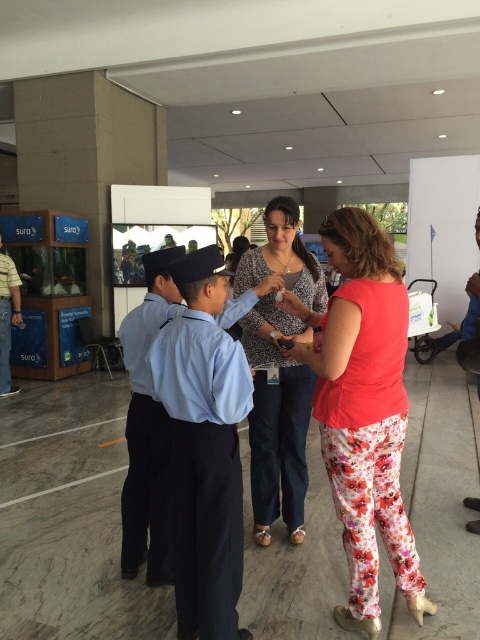
You are a photographer standing at the entrance of the building. You want to take a photo of the two objects labeled floral cotton pants at center and floral pants at center. Since they are both at the center, how far apart are they from each other?

The floral cotton pants at center is 54.94 centimeters away from floral pants at center.

You are a tailor observing two outfits at the center of the scene. The light blue uniform at center and the floral pants at center. Which outfit has a wider width?

The light blue uniform at center has a greater width compared to the floral pants at center as stated in the description.

You are a tailor observing two pairs of pants in the image. The first is labeled as floral cotton pants at center, and the second is floral pants at center. Which pair has a wider leg opening?

The floral cotton pants at center has a wider leg opening than the floral pants at center.